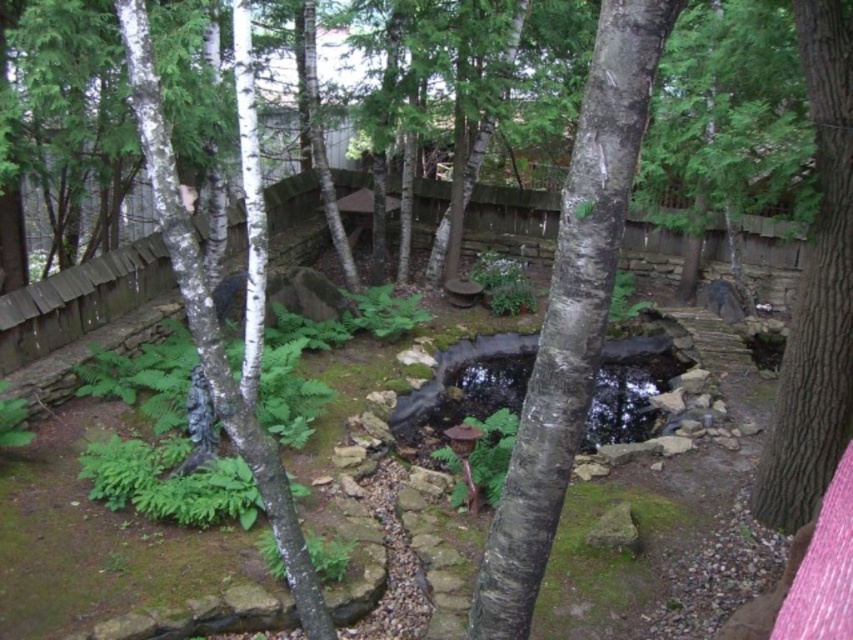
Question: Is white smooth tree trunk at center smaller than brown rough bark tree trunk at right?

Choices:
 (A) no
 (B) yes

Answer: (B)

Question: Which of these objects is positioned closest to the white smooth tree trunk at center?

Choices:
 (A) brown rough bark tree trunk at right
 (B) white smooth tree at center

Answer: (B)

Question: Which object appears farthest from the camera in this image?

Choices:
 (A) white smooth tree at center
 (B) brown rough bark tree trunk at right

Answer: (B)

Question: Does brown rough bark tree trunk at right appear on the right side of white smooth tree at center?

Choices:
 (A) no
 (B) yes

Answer: (B)

Question: Which of the following is the farthest from the observer?

Choices:
 (A) white smooth tree trunk at center
 (B) brown rough bark tree trunk at right

Answer: (B)

Question: Does white smooth tree trunk at center come in front of white smooth tree at center?

Choices:
 (A) no
 (B) yes

Answer: (B)